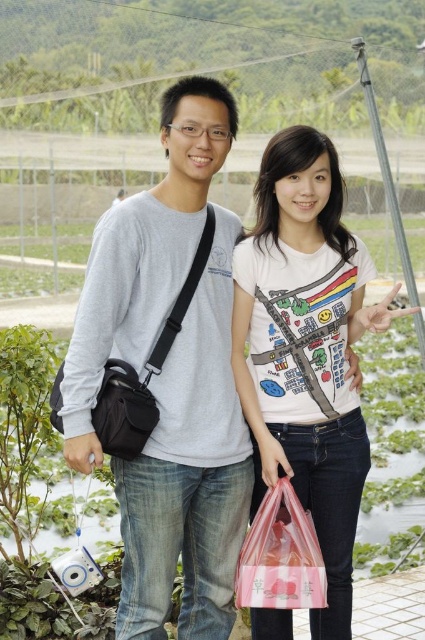
Between gray matte shirt at center and matte black bag at left, which one is positioned higher?

gray matte shirt at center is higher up.

You are a GUI agent. You are given a task and a screenshot of the screen. Output one action in this format:
    pyautogui.click(x=<x>, y=<y>)
    Task: Click on the gray matte shirt at center
    Image resolution: width=425 pixels, height=640 pixels.
    Given the screenshot: What is the action you would take?
    pyautogui.click(x=189, y=472)

Who is more distant from viewer, (201, 88) or (59, 422)?

Point (201, 88)

Where is `gray matte shirt at center`? gray matte shirt at center is located at coordinates (189, 472).

Between gray matte shirt at center and white printed t-shirt at center, which one is positioned higher?

gray matte shirt at center is higher up.

Can you confirm if gray matte shirt at center is taller than white printed t-shirt at center?

Indeed, gray matte shirt at center has a greater height compared to white printed t-shirt at center.

Image resolution: width=425 pixels, height=640 pixels. What do you see at coordinates (189, 472) in the screenshot?
I see `gray matte shirt at center` at bounding box center [189, 472].

Locate an element on the screen. This screenshot has height=640, width=425. gray matte shirt at center is located at coordinates (189, 472).

Does gray matte shirt at center have a greater width compared to black leather bag at left?

Indeed, gray matte shirt at center has a greater width compared to black leather bag at left.

Consider the image. Can you confirm if gray matte shirt at center is positioned above black leather bag at left?

No, gray matte shirt at center is not above black leather bag at left.

Does point (201, 305) come farther from viewer compared to point (189, 276)?

Yes, point (201, 305) is farther from viewer.

Where is `gray matte shirt at center`? This screenshot has height=640, width=425. gray matte shirt at center is located at coordinates (189, 472).